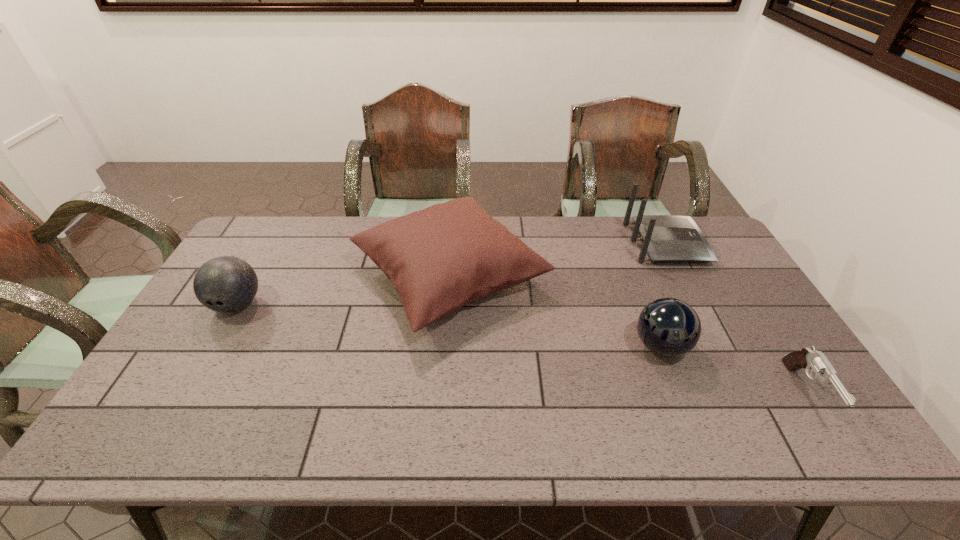
Image resolution: width=960 pixels, height=540 pixels. In order to click on cushion in this screenshot , I will do `click(441, 258)`.

Identify the location of router. (666, 238).

Where is `the leftmost object`? The height and width of the screenshot is (540, 960). the leftmost object is located at coordinates (224, 284).

This screenshot has width=960, height=540. I want to click on the left bowling ball, so click(224, 284).

Locate an element on the screen. The width and height of the screenshot is (960, 540). the nearer bowling ball is located at coordinates (669, 327).

Where is `gun`? gun is located at coordinates coord(807,358).

Find the location of a particular element. the rightmost object is located at coordinates (807, 358).

You are a GUI agent. You are given a task and a screenshot of the screen. Output one action in this format:
    pyautogui.click(x=<x>, y=<y>)
    Task: Click on the free location located 0.340m on the left of the second object from left to right
    Image resolution: width=960 pixels, height=540 pixels.
    Given the screenshot: What is the action you would take?
    pyautogui.click(x=243, y=277)

Where is `free space located 0.300m on the grip area of the farther bowling ball`? The image size is (960, 540). free space located 0.300m on the grip area of the farther bowling ball is located at coordinates (170, 421).

Find the location of a particular element. The image size is (960, 540). free space located on the side of the nearer bowling ball with the finger holes is located at coordinates (551, 346).